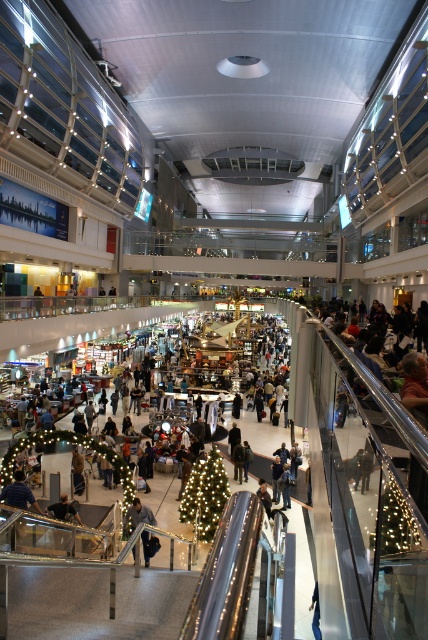
Locate an element on the screen. Image resolution: width=428 pixels, height=640 pixels. illuminated plastic christmas tree at center is located at coordinates (205, 493).

Who is positioned more to the right, illuminated plastic christmas tree at center or dark gray jacket at center?

From the viewer's perspective, illuminated plastic christmas tree at center appears more on the right side.

Between point (216, 483) and point (128, 515), which one is positioned behind?

The point (216, 483) is more distant.

The height and width of the screenshot is (640, 428). I want to click on illuminated plastic christmas tree at center, so click(x=205, y=493).